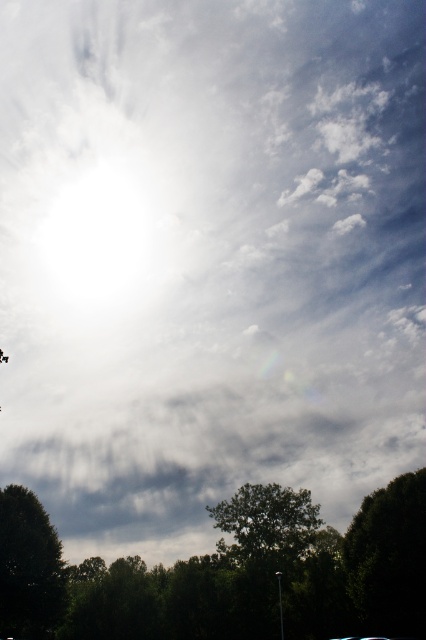
Question: Which point is farther to the camera?

Choices:
 (A) green matte tree at lower left
 (B) dark green leafy tree at lower right

Answer: (A)

Question: Which object appears farthest from the camera in this image?

Choices:
 (A) dark green leafy tree at lower right
 (B) green matte tree at lower left

Answer: (B)

Question: Does dark green leafy tree at lower right have a greater width compared to green matte tree at lower left?

Choices:
 (A) no
 (B) yes

Answer: (B)

Question: Does dark green leafy tree at lower right lie behind green matte tree at lower left?

Choices:
 (A) no
 (B) yes

Answer: (A)

Question: Can you confirm if dark green leafy tree at lower right is thinner than green matte tree at lower left?

Choices:
 (A) yes
 (B) no

Answer: (B)